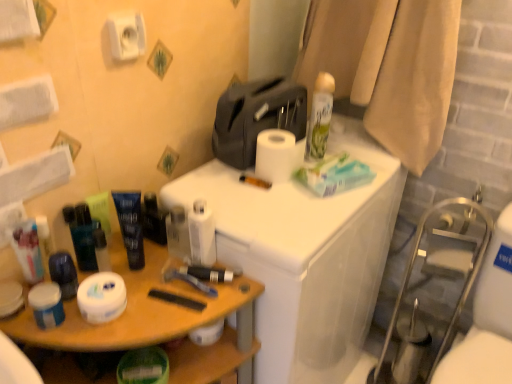
Find the location of a particular element. vacant space in front of matte green tube at left, arranged as the third toiletry when viewed from the left is located at coordinates (127, 301).